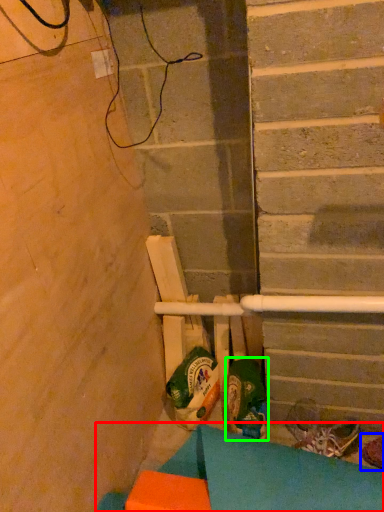
Question: Considering the real-world distances, which object is closest to furniture (highlighted by a red box)? footwear (highlighted by a blue box) or footwear (highlighted by a green box).

Choices:
 (A) footwear
 (B) footwear

Answer: (B)